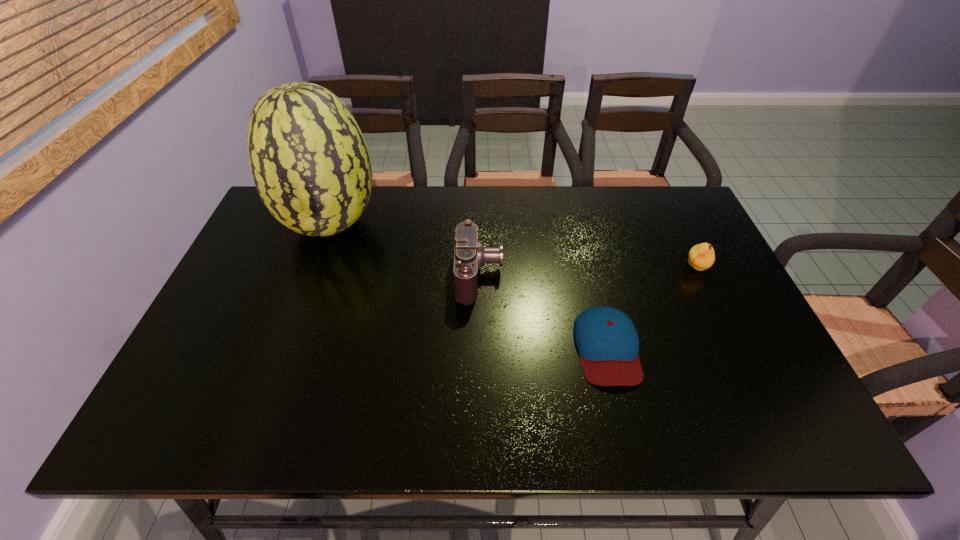
Locate an element on the screen. vacant area that lies between the third tallest object and the leftmost object is located at coordinates (514, 247).

Locate an element on the screen. The image size is (960, 540). empty space between the third object from right to left and the leftmost object is located at coordinates (405, 250).

Where is `vacant point located between the second object from left to right and the watermelon`? The height and width of the screenshot is (540, 960). vacant point located between the second object from left to right and the watermelon is located at coordinates (405, 250).

Locate an element on the screen. Image resolution: width=960 pixels, height=540 pixels. empty space between the leftmost object and the second shortest object is located at coordinates (514, 247).

Identify the location of free spot between the camera and the watermelon. The image size is (960, 540). (405, 250).

Find the location of a particular element. This screenshot has height=540, width=960. vacant area that lies between the third tallest object and the camera is located at coordinates (588, 271).

I want to click on free point between the second object from left to right and the shortest object, so (543, 311).

Identify which object is the second nearest to the shortest object. Please provide its 2D coordinates. Your answer should be formatted as a tuple, i.e. [(x, y)], where the tuple contains the x and y coordinates of a point satisfying the conditions above.

[(702, 256)]

Choose which object is the third nearest neighbor to the second tallest object. Please provide its 2D coordinates. Your answer should be formatted as a tuple, i.e. [(x, y)], where the tuple contains the x and y coordinates of a point satisfying the conditions above.

[(702, 256)]